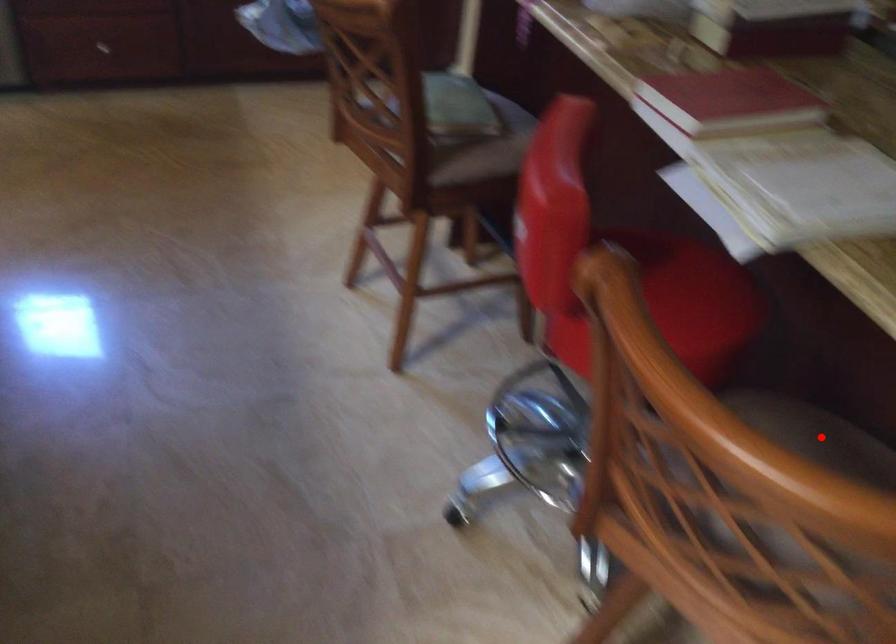
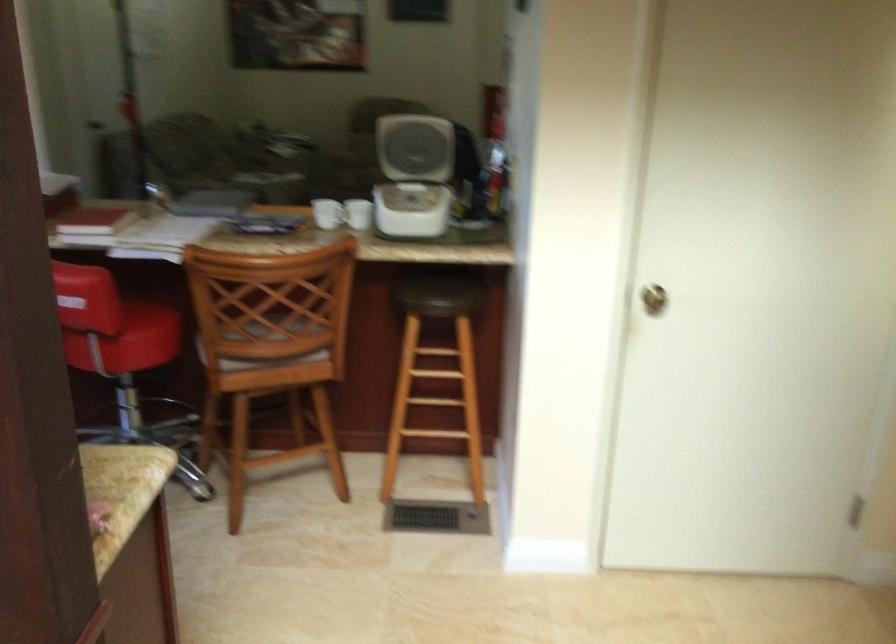
Question: I am providing you with two images of the same scene from different viewpoints. A red point is marked on the first image. Can you still see the location of the red point in image 2?

Choices:
 (A) Yes
 (B) No

Answer: (B)